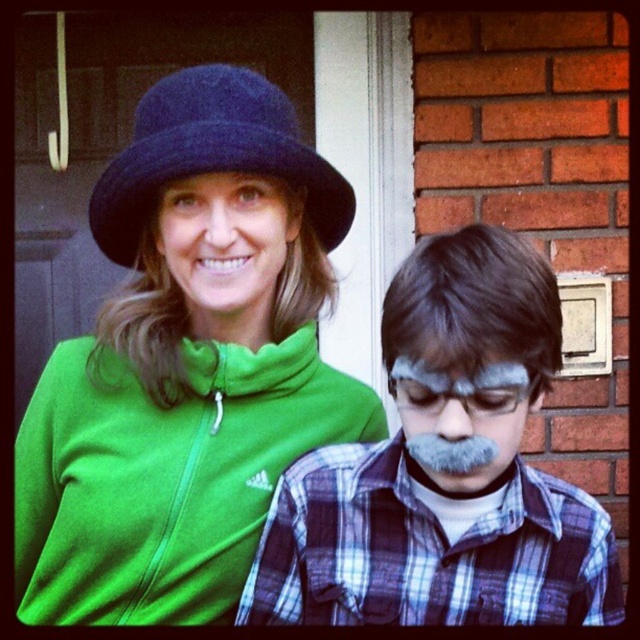
Question: Which of the following is the farthest from the observer?

Choices:
 (A) (180, 99)
 (B) (49, 531)
 (C) (515, 424)

Answer: (B)

Question: Which object appears farthest from the camera in this image?

Choices:
 (A) matte green hoodie at upper left
 (B) plaid fabric shirt at center

Answer: (A)

Question: Which object is the farthest from the gray matte face at center?

Choices:
 (A) matte green hat at upper center
 (B) matte green hoodie at upper left
 (C) dark blue felt hat at upper center

Answer: (C)

Question: Where is plaid fabric shirt at center located in relation to matte green hat at upper center in the image?

Choices:
 (A) above
 (B) below

Answer: (B)

Question: In this image, where is dark blue felt hat at upper center located relative to matte green hat at upper center?

Choices:
 (A) above
 (B) below

Answer: (A)

Question: From the image, what is the correct spatial relationship of plaid fabric shirt at center in relation to matte green hat at upper center?

Choices:
 (A) below
 (B) above

Answer: (A)